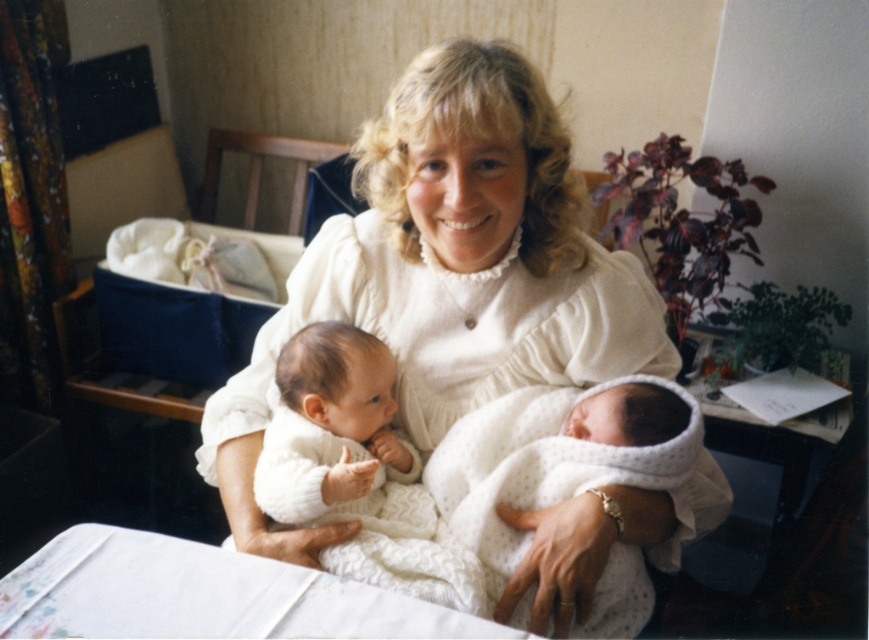
Question: Is the position of white knitted dress at center less distant than that of white knitted blanket at center?

Choices:
 (A) yes
 (B) no

Answer: (A)

Question: Estimate the real-world distances between objects in this image. Which object is closer to the white knitted blanket at center?

Choices:
 (A) white knitted sweater at center
 (B) white knitted dress at center

Answer: (B)

Question: Can you confirm if white knitted blanket at center is smaller than white knitted sweater at center?

Choices:
 (A) no
 (B) yes

Answer: (A)

Question: Which object is the farthest from the white knitted sweater at center?

Choices:
 (A) white knitted blanket at center
 (B) white knitted dress at center

Answer: (A)

Question: Can you confirm if white knitted blanket at center is positioned above white knitted sweater at center?

Choices:
 (A) no
 (B) yes

Answer: (A)

Question: Which point appears closest to the camera in this image?

Choices:
 (A) (461, 189)
 (B) (565, 474)

Answer: (A)